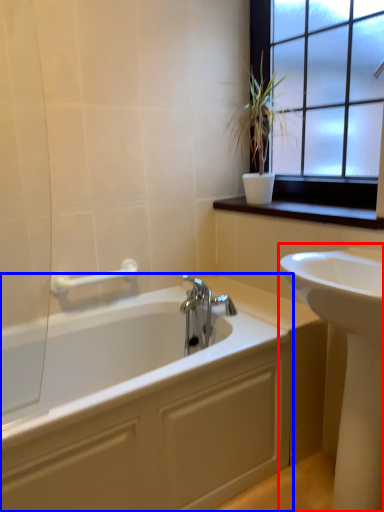
Question: Which object appears farthest to the camera in this image, sink (highlighted by a red box) or bathtub (highlighted by a blue box)?

Choices:
 (A) sink
 (B) bathtub

Answer: (B)